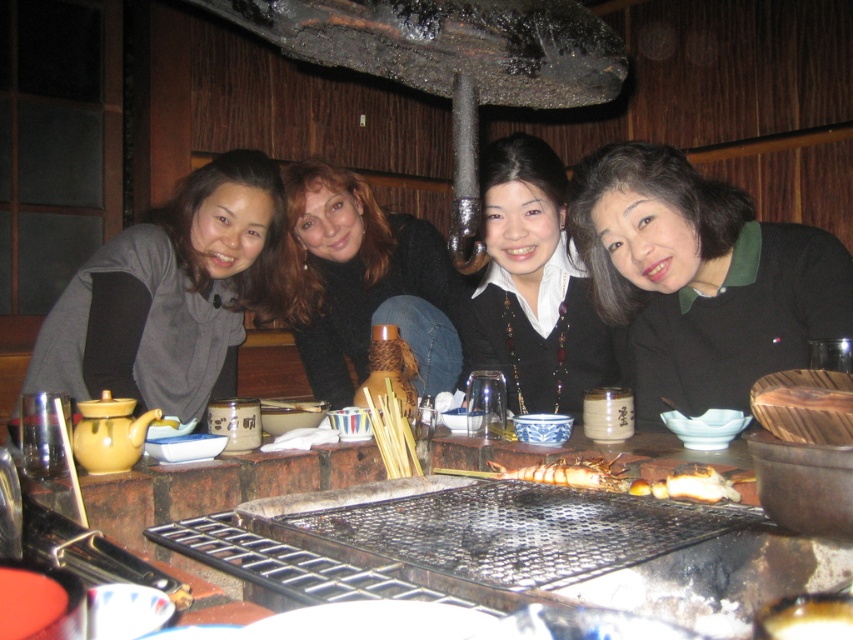
You are a guest at this gathering and want to place your napkin on the table without covering any of the existing items. Considering the metal grill at center and the matte gray sweater at center, where should you place it?

The metal grill at center is on the right side of the matte gray sweater at center, so placing the napkin to the left of the matte gray sweater at center would avoid covering both items.

From the picture: You are one of the women sitting at the table. You want to reach for the shiny brown shrimp at center without moving the smooth black sweater at center. Is this possible?

The shiny brown shrimp at center is behind the smooth black sweater at center, so you can reach for the shrimp by moving around the sweater without disturbing it.